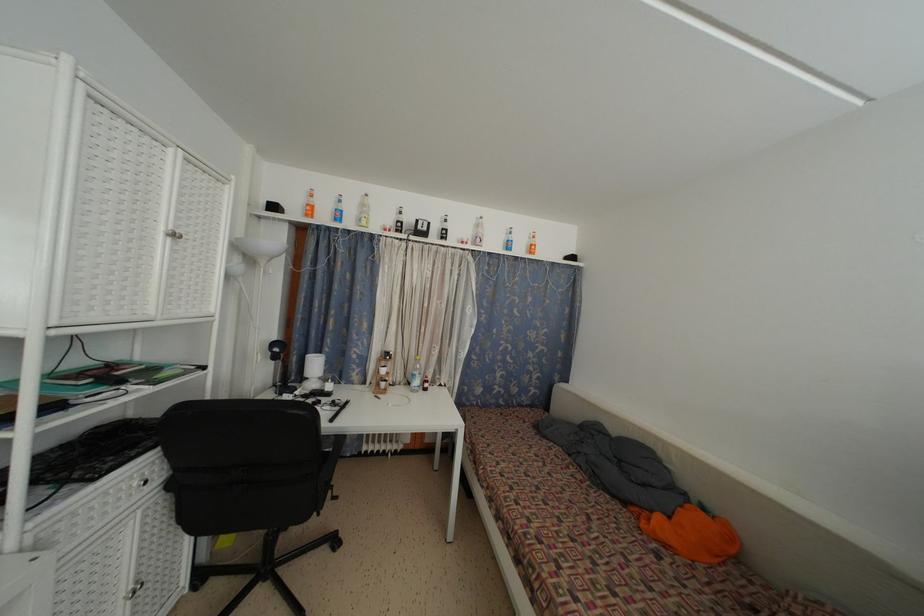
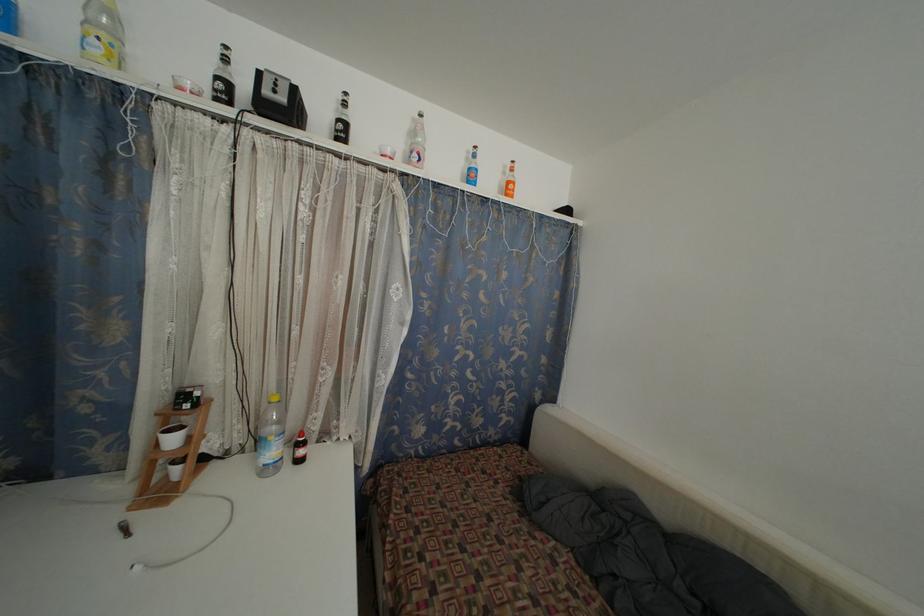
Question: I am providing you with two images of the same scene from different viewpoints. After the viewpoint changes to image2, which objects are now occluded?

Choices:
 (A) large plastic bottle
 (B) small brown bottle
 (C) orange glass bottle
 (D) none of these

Answer: (D)